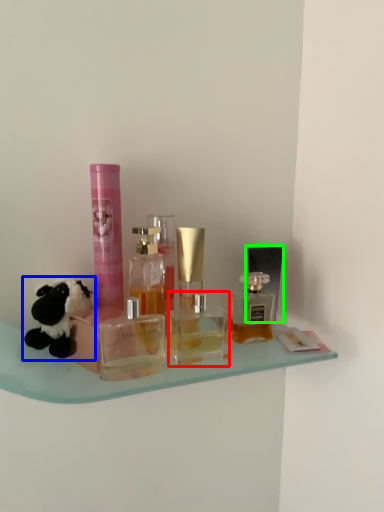
Question: Based on their relative distances, which object is farther from bottle (highlighted by a red box)? Choose from toy (highlighted by a blue box) and toiletry (highlighted by a green box).

Choices:
 (A) toy
 (B) toiletry

Answer: (A)